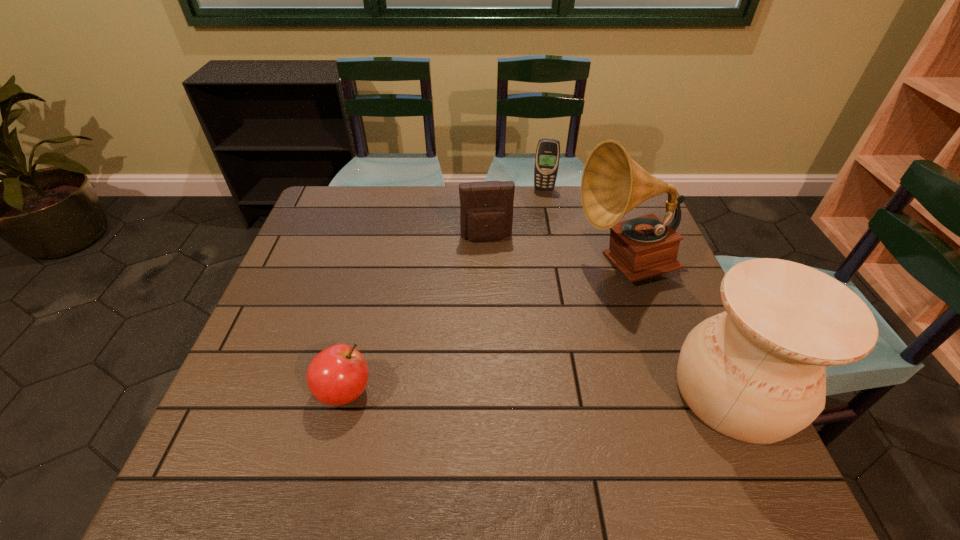
The width and height of the screenshot is (960, 540). What are the coordinates of `free space on the desktop that is between the apple and the pottery and is positioned with an open flap on the fourth object from right to left` in the screenshot? It's located at (512, 392).

Find the location of `vacant space on the desktop that is between the leftmost object and the second tallest object and is positioned on the horn of the tallest object`. vacant space on the desktop that is between the leftmost object and the second tallest object and is positioned on the horn of the tallest object is located at coordinates (483, 392).

Locate an element on the screen. vacant space on the desktop that is between the apple and the pottery and is positioned on the screen of the cellular telephone is located at coordinates (517, 392).